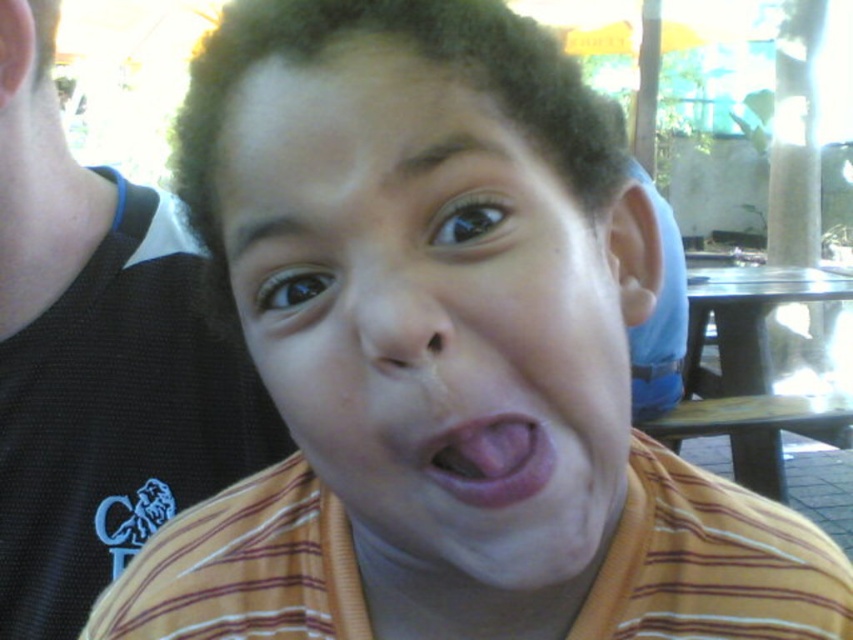
You are a photographer adjusting your camera settings. You need to capture a clear photo of both the yellow striped shirt at center and the black mesh tank top at left without any blur. The camera has a depth of field that can focus on objects within 10 inches of each other. Will both objects be in focus?

The yellow striped shirt at center is 12.75 inches from the black mesh tank top at left. Since the distance between them exceeds the camera depth of field limit of 10 inches, the objects will not both be in focus.

You are a photographer adjusting the camera focus. The subject is the pink flesh at center, and there is a black mesh tank top at left in the frame. Which object should you focus on first to ensure the subject is clear?

You should focus on the pink flesh at center first because it is the subject, and the black mesh tank top at left is taller than pink flesh at center but not the main focus.

You are a photographer trying to capture a candid shot of the child in the image. The camera you are using has a focal length of 50mm and an aperture of f2.8. To ensure both the black mesh tank top at left and the pink flesh at center are in focus, what should you consider about their distance apart?

The black mesh tank top at left is 16.58 inches away from the pink flesh at center. Since the distance between them is relatively small, you can achieve focus on both by using a smaller aperture like f8 or higher, which increases depth of field, allowing both objects to be in focus.